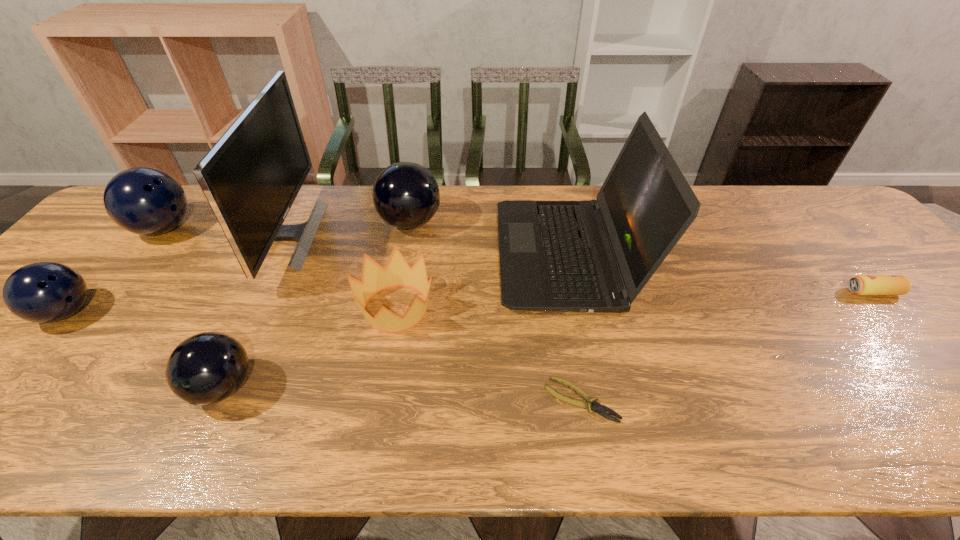
I want to click on the seventh tallest object, so click(397, 272).

You are a GUI agent. You are given a task and a screenshot of the screen. Output one action in this format:
    pyautogui.click(x=<x>, y=<y>)
    Task: Click on the crown
    This screenshot has width=960, height=540.
    Given the screenshot: What is the action you would take?
    pyautogui.click(x=397, y=272)

At what (x,y) coordinates should I click in order to perform the action: click on beer can. Please return your answer as a coordinate pair (x, y). This screenshot has width=960, height=540. Looking at the image, I should click on (861, 284).

Where is `the rightmost object`? This screenshot has width=960, height=540. the rightmost object is located at coordinates (861, 284).

Find the location of a particular element. This screenshot has width=960, height=540. pliers is located at coordinates (597, 407).

Locate an element on the screen. This screenshot has width=960, height=540. yellow pliers is located at coordinates (597, 407).

In order to click on vacant space located 0.310m on the screen side of the monitor in this screenshot , I will do `click(421, 235)`.

This screenshot has height=540, width=960. In order to click on vacant space located 0.170m on the screen of the laptop_computer in this screenshot , I will do 438,255.

Where is `vacant space located 0.230m on the screen of the laptop_computer`? Image resolution: width=960 pixels, height=540 pixels. vacant space located 0.230m on the screen of the laptop_computer is located at coordinates (417, 255).

The width and height of the screenshot is (960, 540). Identify the location of free space located on the screen of the laptop_computer. (363, 255).